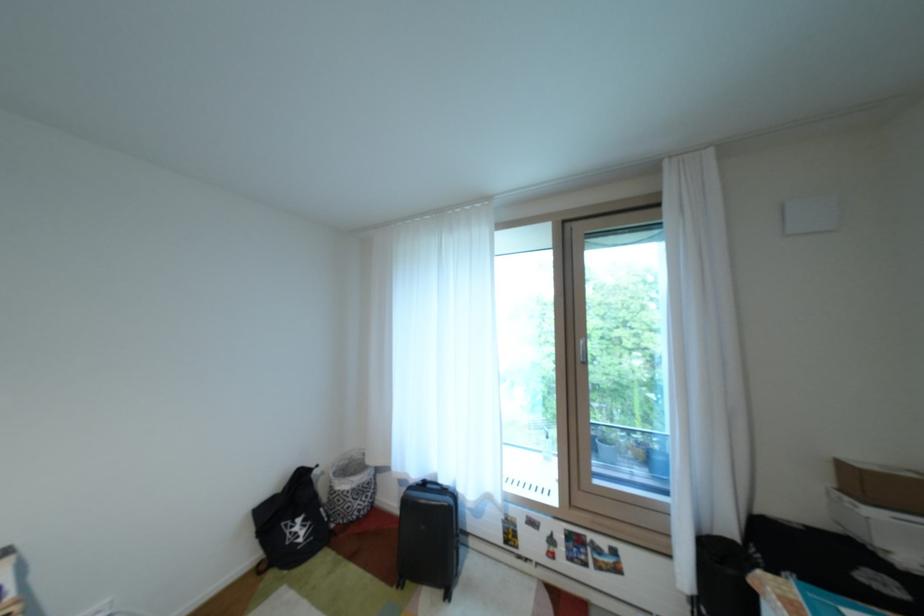
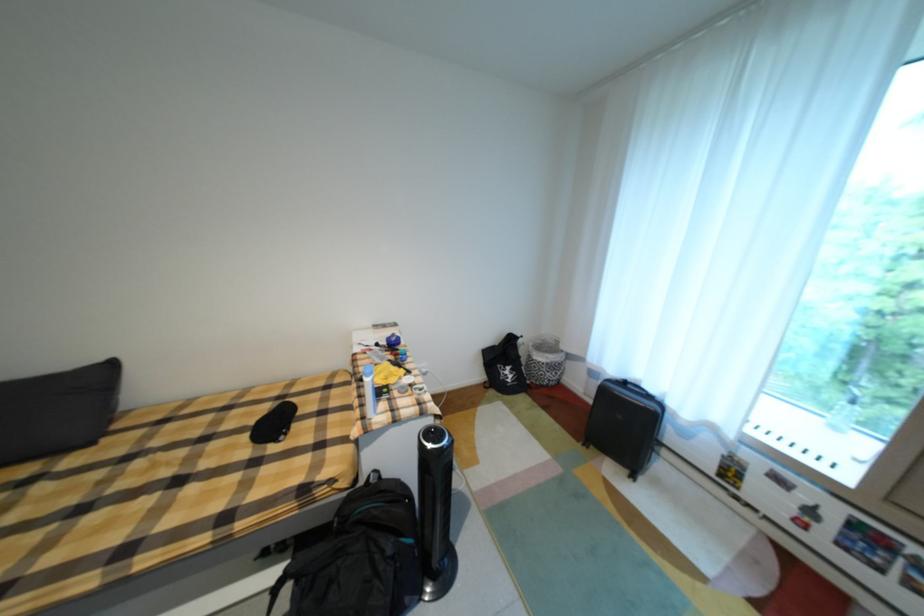
Find the pixel in the second image that matches pixel 327 468 in the first image.

(531, 338)